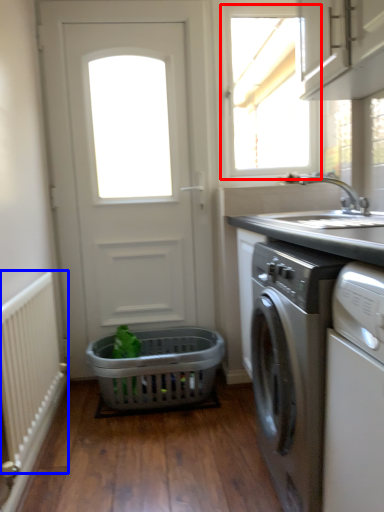
Question: Which point is closer to the camera, window (highlighted by a red box) or radiator (highlighted by a blue box)?

Choices:
 (A) window
 (B) radiator

Answer: (B)